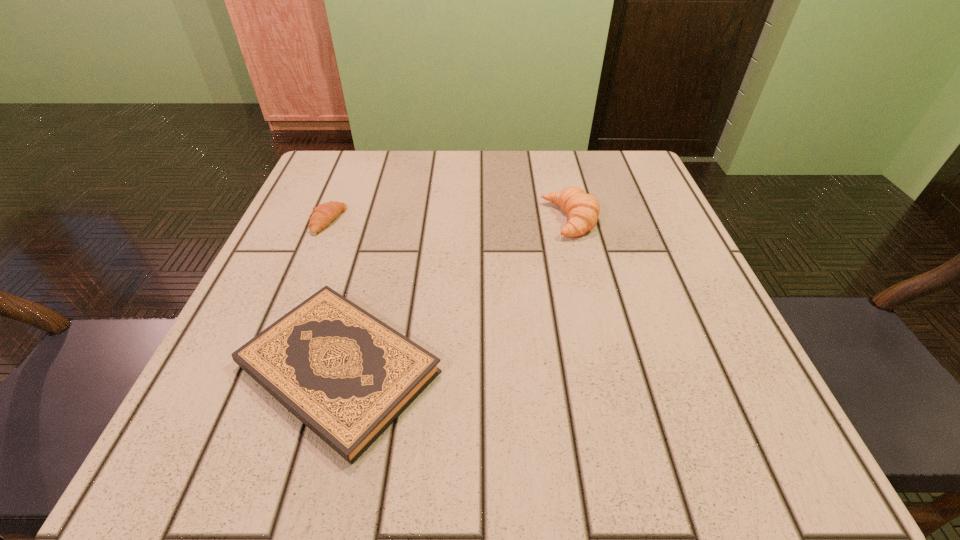
Where is `object present at the right edge`? The image size is (960, 540). object present at the right edge is located at coordinates (583, 209).

This screenshot has width=960, height=540. In order to click on object positioned at the far left corner in this screenshot , I will do `click(322, 215)`.

The image size is (960, 540). I want to click on object located at the near left corner, so 345,374.

In order to click on object at the far right corner in this screenshot , I will do `click(583, 209)`.

In order to click on vacant space at the far edge of the desktop in this screenshot , I will do `click(376, 204)`.

I want to click on vacant position at the near edge of the desktop, so click(419, 415).

Where is `vacant space at the left edge of the desktop`? The height and width of the screenshot is (540, 960). vacant space at the left edge of the desktop is located at coordinates (317, 274).

Where is `vacant region at the right edge`? This screenshot has height=540, width=960. vacant region at the right edge is located at coordinates (705, 364).

The height and width of the screenshot is (540, 960). What are the coordinates of `vacant space at the far left corner of the desktop` in the screenshot? It's located at (373, 178).

Image resolution: width=960 pixels, height=540 pixels. I want to click on vacant space at the far right corner of the desktop, so click(x=656, y=190).